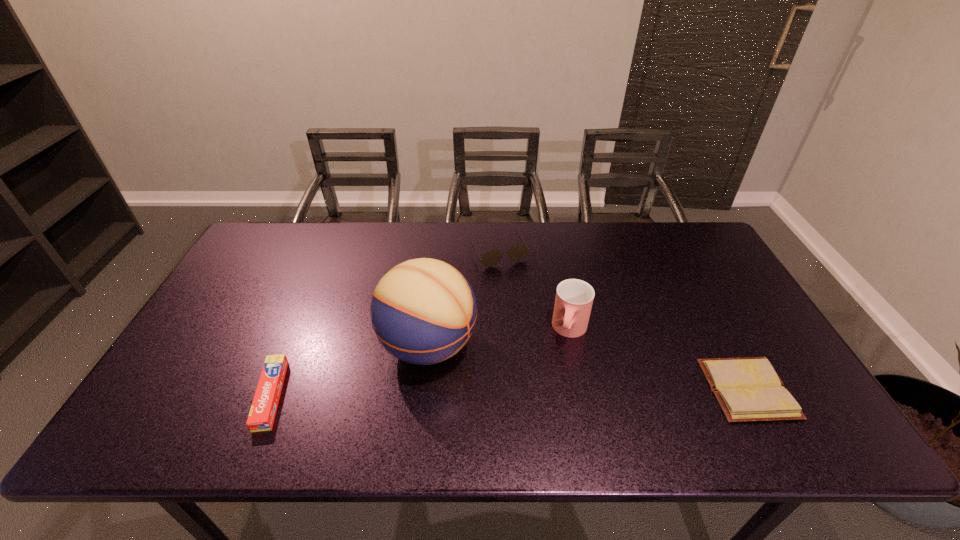
Locate an element on the screen. The width and height of the screenshot is (960, 540). free space on the desktop that is between the toothpaste and the shortest object and is positioned on the front-facing side of the farthest object is located at coordinates (576, 392).

Locate an element on the screen. Image resolution: width=960 pixels, height=540 pixels. vacant space on the desktop that is between the leftmost object and the shortest object and is positioned on the patterned surface of the tallest object is located at coordinates (523, 392).

At what (x,y) coordinates should I click in order to perform the action: click on vacant spot on the desktop that is between the toothpaste and the shortest object and is positioned on the side of the fourth object from left to right with the handle. Please return your answer as a coordinate pair (x, y). Looking at the image, I should click on (552, 392).